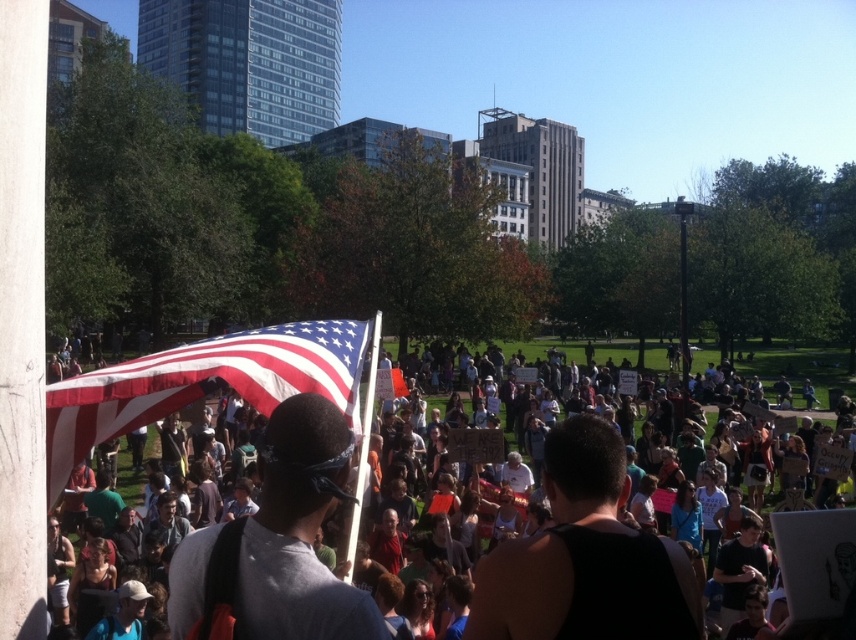
You are a photographer trying to capture a clear shot of the white tank top at center without the american flag at center blocking it. What adjustment should you make to your camera angle?

To avoid the american flag at center blocking the white tank top at center, you should lower your camera angle since the american flag at center is positioned over the white tank top at center.